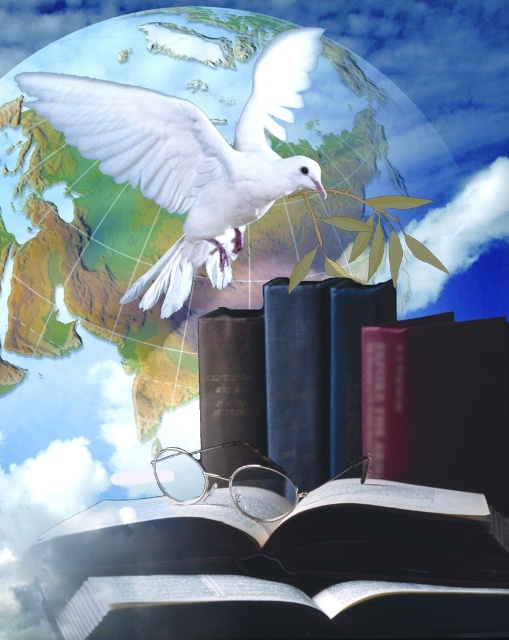
Question: Is matte black book at center closer to camera compared to white matte dove at upper center?

Choices:
 (A) no
 (B) yes

Answer: (B)

Question: Which point is closer to the camera taking this photo?

Choices:
 (A) (150, 134)
 (B) (123, 508)

Answer: (B)

Question: Considering the relative positions of matte black book at center and white matte dove at upper center in the image provided, where is matte black book at center located with respect to white matte dove at upper center?

Choices:
 (A) right
 (B) left

Answer: (A)

Question: Does matte black book at center have a lesser width compared to white matte dove at upper center?

Choices:
 (A) no
 (B) yes

Answer: (A)

Question: Which point is closer to the camera?

Choices:
 (A) white matte dove at upper center
 (B) matte black book at center

Answer: (B)